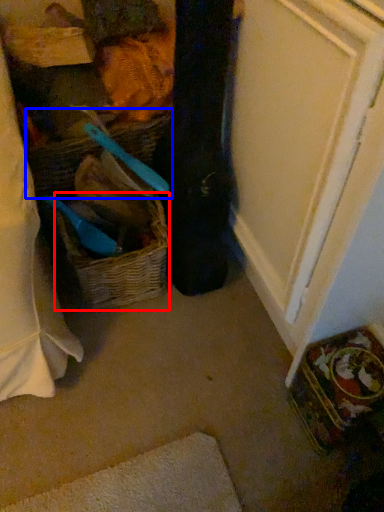
Question: Which of the following is the farthest to the observer, picnic basket (highlighted by a red box) or basket (highlighted by a blue box)?

Choices:
 (A) picnic basket
 (B) basket

Answer: (A)